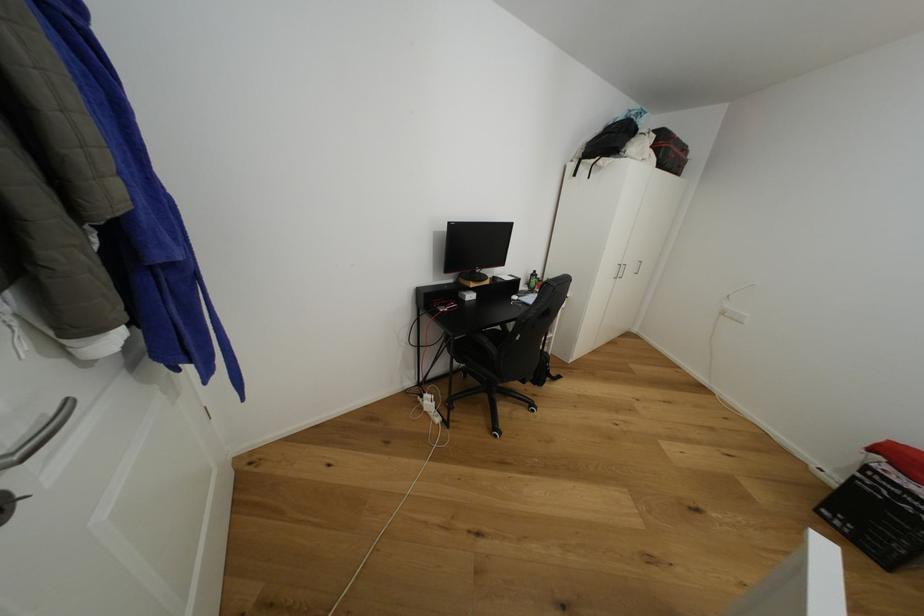
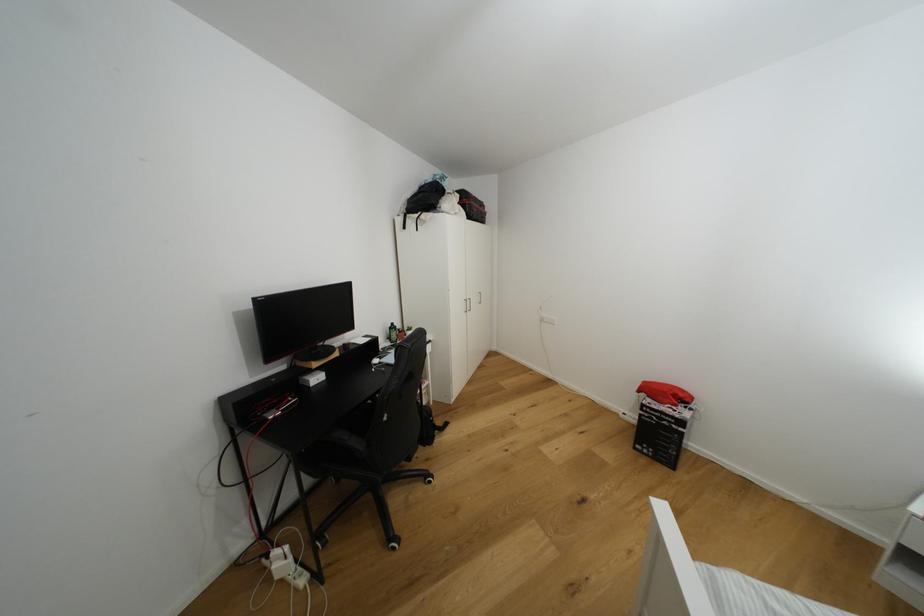
Where in the second image is the point corresponding to the point at 822,513 from the first image?

(639, 450)